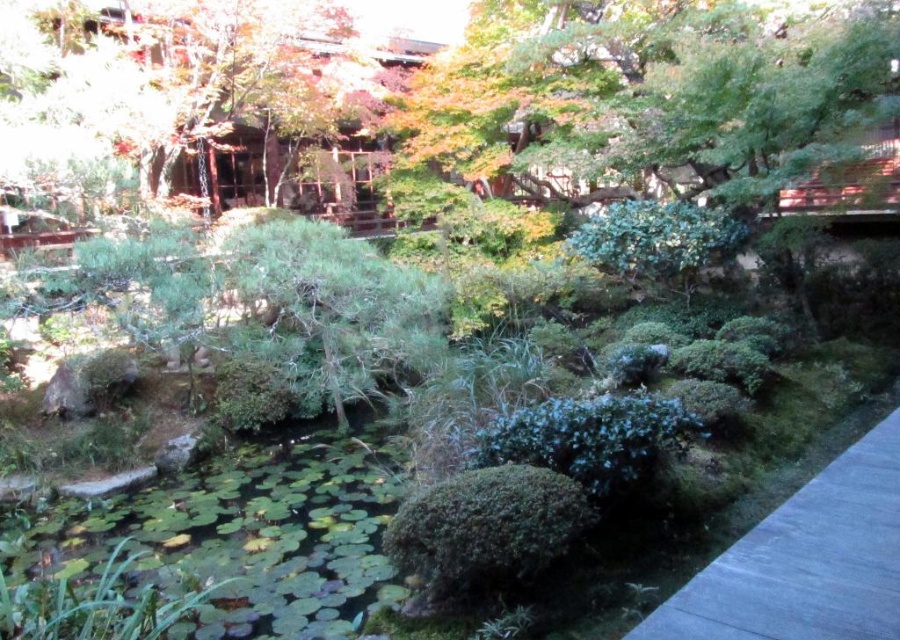
You are a visitor in the Japanese garden and want to take a photo of the green leafy pond at lower left and the gray concrete path at lower right. Which object should you focus on first if you want to capture both in one frame without moving the camera?

You should focus on the gray concrete path at lower right first because it is above the green leafy pond at lower left, so adjusting the camera angle to include both would require ensuring the path is in the upper part of the frame while the pond remains at the lower part.

You are a gardener planning to place a 3 meter wide decorative stone sculpture in the garden. You have two options for placement locations based on available space. The first option is near the green leafy pond at lower left, and the second is near the gray concrete path at lower right. Which location has enough space to accommodate the sculpture without overcrowding?

The green leafy pond at lower left has a greater width than the gray concrete path at lower right according to the description. Therefore, placing the 3 meter wide decorative stone sculpture near the green leafy pond at lower left would provide sufficient space compared to the narrower gray concrete path at lower right.